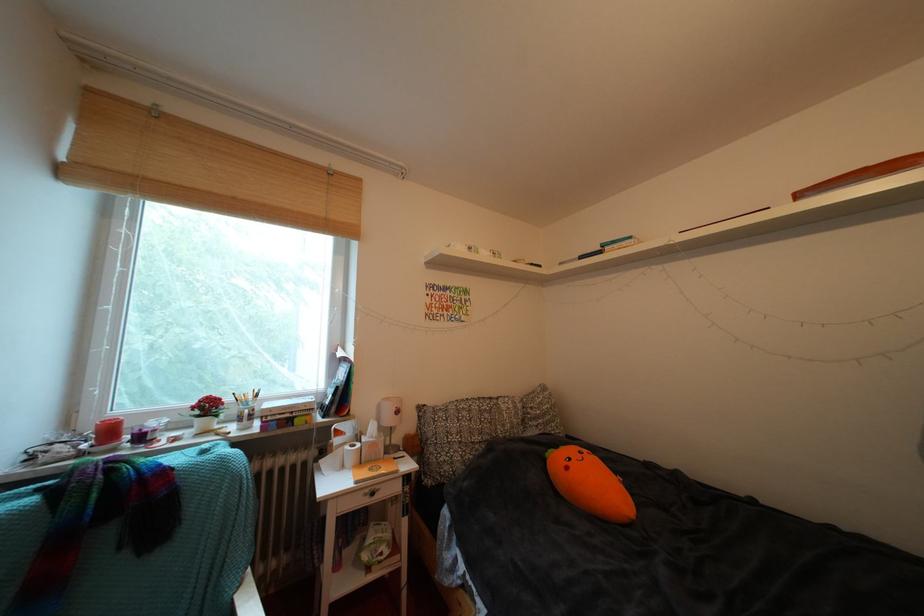
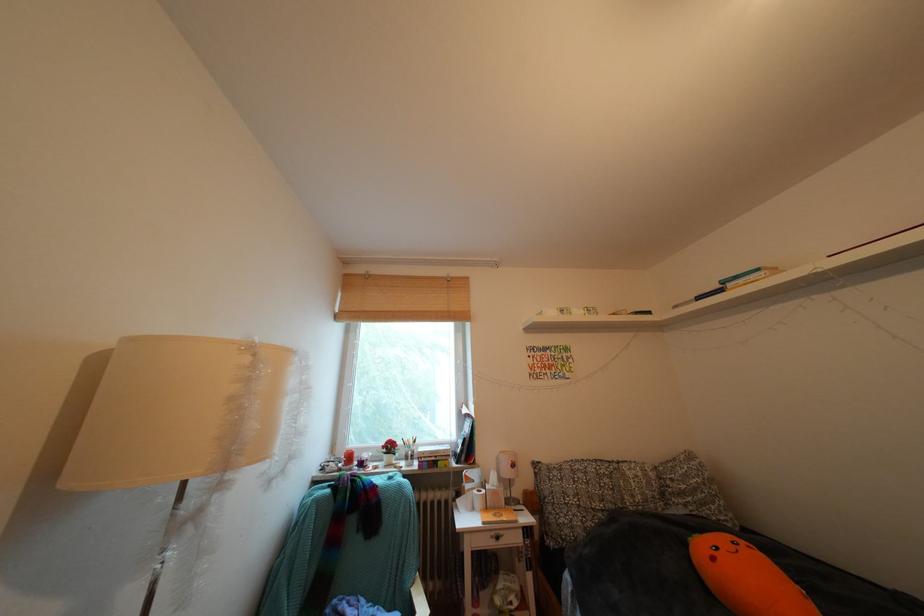
The point at (578, 472) is marked in the first image. Where is the corresponding point in the second image?

(723, 564)